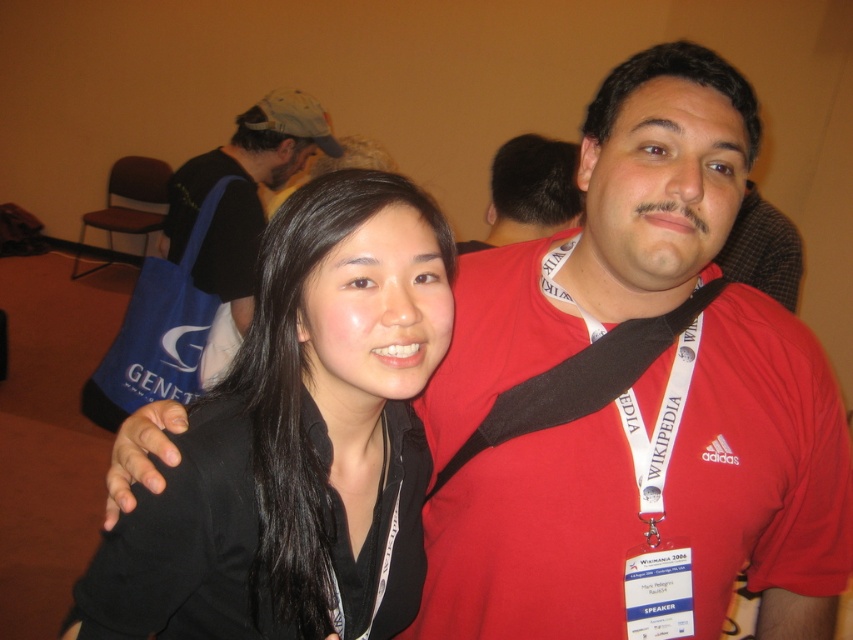
Can you confirm if black matte/black hair at center is thinner than red matte shirt at upper right?

No, black matte/black hair at center is not thinner than red matte shirt at upper right.

Is point (297, 285) behind point (490, 227)?

No, (297, 285) is in front of (490, 227).

What do you see at coordinates (299, 438) in the screenshot?
I see `black matte/black hair at center` at bounding box center [299, 438].

The height and width of the screenshot is (640, 853). What are the coordinates of `black matte/black hair at center` in the screenshot? It's located at (299, 438).

Who is shorter, black matte/black hair at center or black t-shirt at center?

black matte/black hair at center is shorter.

Between point (280, 499) and point (291, 156), which one is positioned in front?

Point (280, 499) is more forward.

Who is more distant from viewer, (212,556) or (244,198)?

Point (244,198)

Image resolution: width=853 pixels, height=640 pixels. Find the location of `black matte/black hair at center`. black matte/black hair at center is located at coordinates (299, 438).

Is black t-shirt at center positioned in front of red matte shirt at upper right?

Yes.

Can you confirm if black t-shirt at center is taller than red matte shirt at upper right?

Yes.

The image size is (853, 640). In order to click on black t-shirt at center in this screenshot , I will do coord(241,208).